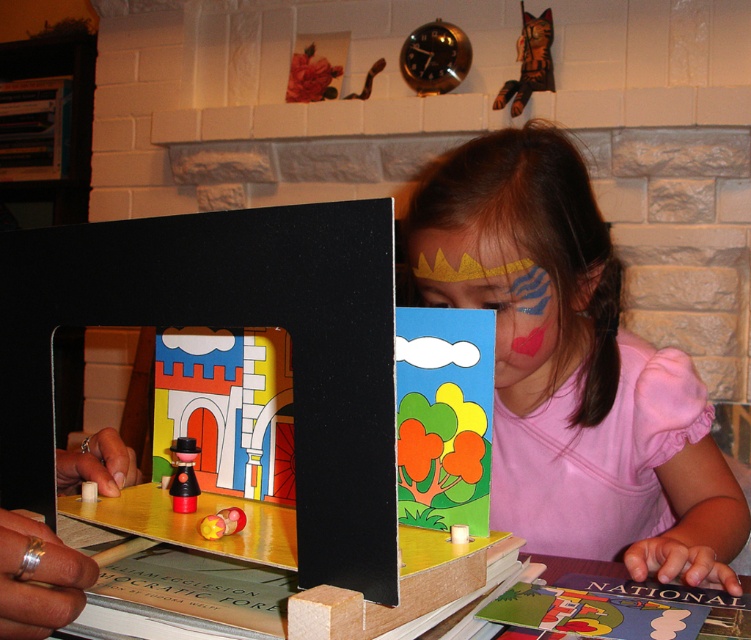
You are a child who wants to reach both the wooden cat at upper center and the smooth plastic toy at center. Which object should you reach for first if you want to grab the one closer to your face?

The wooden cat at upper center is above the smooth plastic toy at center, so it is closer to your face. You should reach for the wooden cat at upper center first.

You are a toy organizer trying to place the wooden cat at upper center and the smooth plastic toy at center into storage boxes. The wooden cat box can only fit items wider than 20 cm. Can both items fit in their respective boxes if the smooth plastic toy is exactly 15 cm wide?

The wooden cat at upper center is wider than the smooth plastic toy at center, which is 15 cm. Since the wooden cat is wider than 15 cm and the box requires items wider than 20 cm, it depends on the exact width of the wooden cat. However, the information provided does not specify the wooden cat at upper center is wider than 20 cm, so we cannot confirm if it fits.

Based on the coordinates provided, where is the matte pink face at center located in the image?

The matte pink face at center is located at the coordinates point (496, 304).